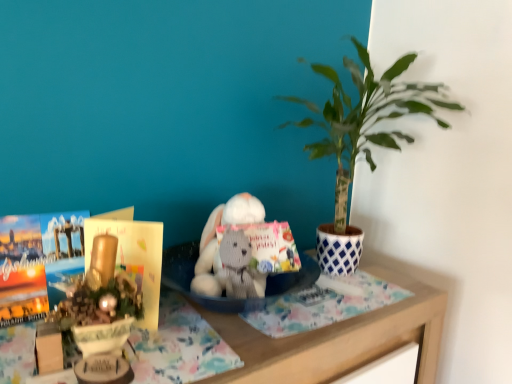
At what (x,y) coordinates should I click in order to perform the action: click on free point to the right of gray knitted stuffed animal at center. Please return your answer as a coordinate pair (x, y). The height and width of the screenshot is (384, 512). Looking at the image, I should click on (308, 311).